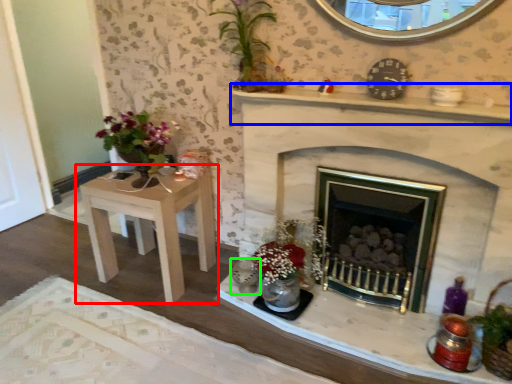
Question: Considering the real-world distances, which object is farthest from table (highlighted by a red box)? mantle (highlighted by a blue box) or candle holder (highlighted by a green box)?

Choices:
 (A) mantle
 (B) candle holder

Answer: (A)